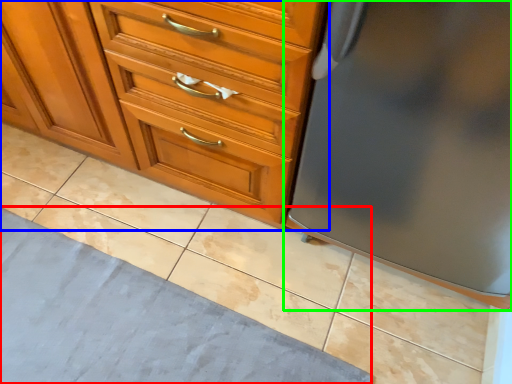
Question: Which is nearer to the bath mat (highlighted by a red box)? chest of drawers (highlighted by a blue box) or refrigerator (highlighted by a green box).

Choices:
 (A) chest of drawers
 (B) refrigerator

Answer: (A)